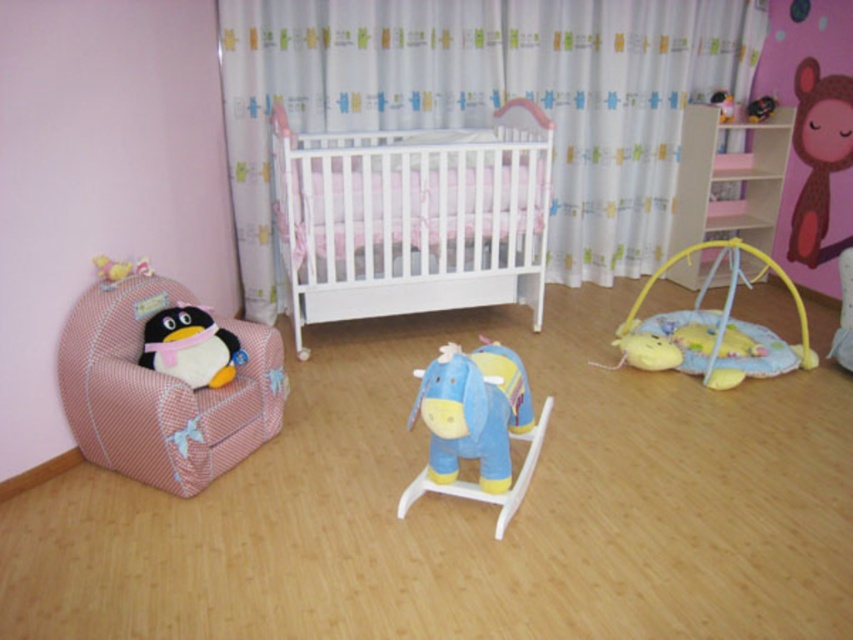
Question: Is white fabric curtain at center wider than matte black monkey at upper right?

Choices:
 (A) yes
 (B) no

Answer: (A)

Question: Which object is the closest to the pink plush monkey at upper right?

Choices:
 (A) shiny metallic camera at upper right
 (B) yellow plush toy at left
 (C) matte black monkey at upper right
 (D) blue plush rocking horse at center

Answer: (C)

Question: Among these objects, which one is nearest to the camera?

Choices:
 (A) white wooden crib at center
 (B) matte plush penguin at left
 (C) shiny metallic camera at upper right
 (D) pink fabric armchair at left

Answer: (D)

Question: Is white wooden crib at center above soft yellow fabric play mat at lower right?

Choices:
 (A) yes
 (B) no

Answer: (A)

Question: Considering the relative positions of pink fabric armchair at left and pink plush monkey at upper right in the image provided, where is pink fabric armchair at left located with respect to pink plush monkey at upper right?

Choices:
 (A) left
 (B) right

Answer: (A)

Question: Which point is closer to the camera taking this photo?

Choices:
 (A) (637, 346)
 (B) (457, 148)
 (C) (729, 109)
 (D) (242, 397)

Answer: (D)